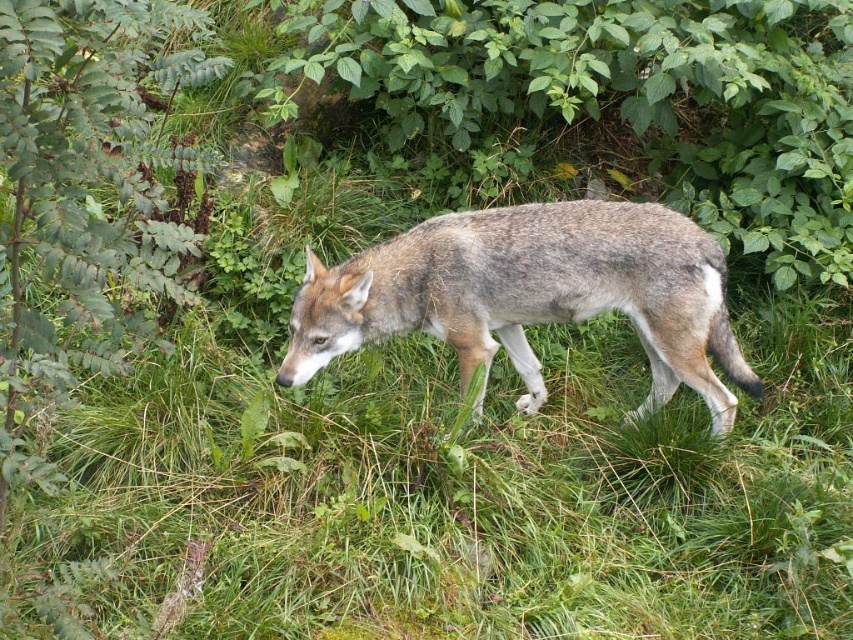
The wolf is walking in the lush green environment. There is a point at coordinates (x=83, y=192). What does this point represent?

The point at coordinates (x=83, y=192) represents the green leafy bush at left.

You are a photographer trying to capture the gray fur wolf at center. You notice a green leafy bush at left in the background. Considering their sizes, which object would appear bigger in your photo?

The green leafy bush at left would appear bigger in the photo since it has a larger size compared to the gray fur wolf at center.